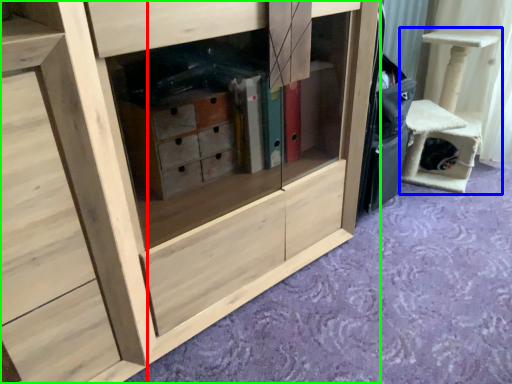
Question: Estimate the real-world distances between objects in this image. Which object is farther from chest of drawers (highlighted by a red box), furniture (highlighted by a blue box) or cabinetry (highlighted by a green box)?

Choices:
 (A) furniture
 (B) cabinetry

Answer: (A)